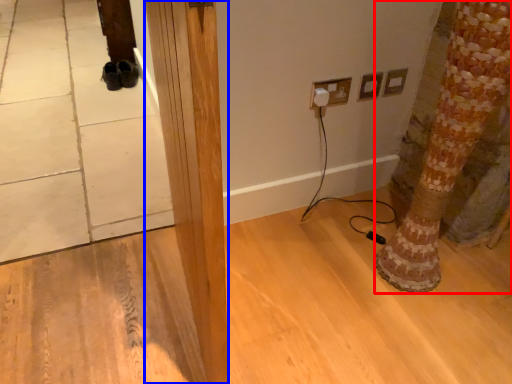
Question: Which of the following is the closest to the observer, tree trunk (highlighted by a red box) or pillar (highlighted by a blue box)?

Choices:
 (A) tree trunk
 (B) pillar

Answer: (B)